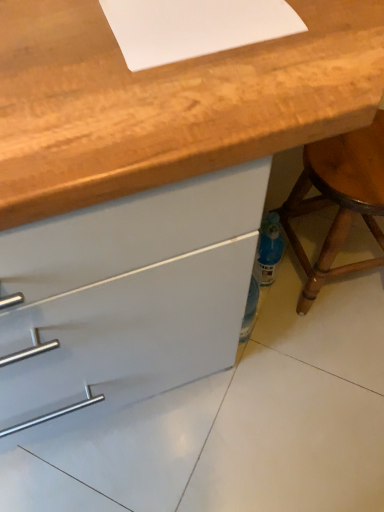
The width and height of the screenshot is (384, 512). Describe the element at coordinates (167, 102) in the screenshot. I see `wooden at upper center` at that location.

In order to face wooden at upper center, should I rotate leftwards or rightwards?

You should rotate left by 4.256 degrees.

Where is `wooden at upper center`? The image size is (384, 512). wooden at upper center is located at coordinates (167, 102).

What is the approximate width of wooden at upper center?

wooden at upper center is 19.75 inches in width.

At what (x,y) coordinates should I click in order to perform the action: click on wooden at upper center. Please return your answer as a coordinate pair (x, y). Looking at the image, I should click on pyautogui.click(x=167, y=102).